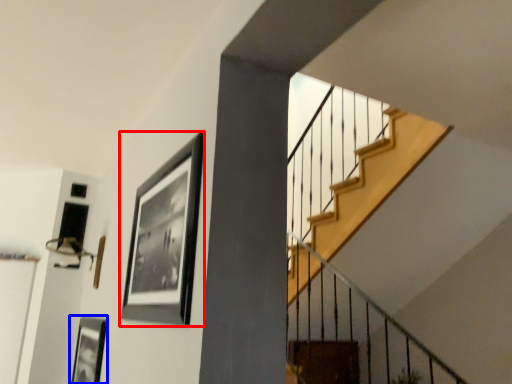
Question: Which of the following is the farthest to the observer, picture frame (highlighted by a red box) or picture frame (highlighted by a blue box)?

Choices:
 (A) picture frame
 (B) picture frame

Answer: (B)